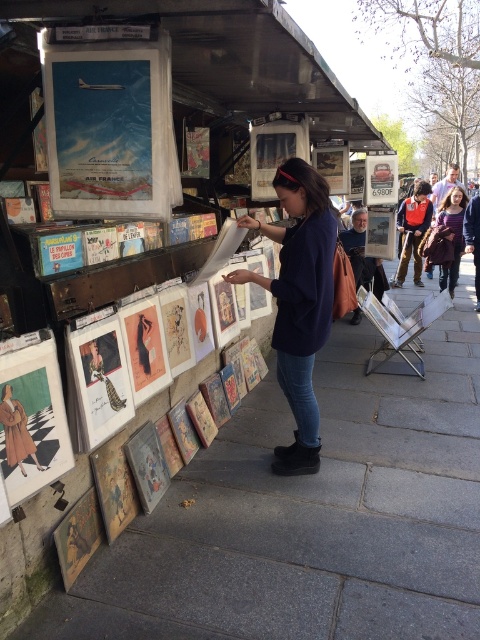
Does jeans at center have a smaller size compared to blue denim jeans at center?

→ Yes.

Who is more forward, (285, 365) or (442, 289)?

Point (285, 365) is in front.

Locate an element on the screen. jeans at center is located at coordinates (300, 396).

What do you see at coordinates (299, 301) in the screenshot? The height and width of the screenshot is (640, 480). I see `dark blue sweater at center` at bounding box center [299, 301].

Between dark blue sweater at center and striped sweater at center, which one is positioned lower?

dark blue sweater at center is lower down.

Where is `dark blue sweater at center`? The height and width of the screenshot is (640, 480). dark blue sweater at center is located at coordinates (299, 301).

Where is `dark blue sweater at center`? The width and height of the screenshot is (480, 640). dark blue sweater at center is located at coordinates (299, 301).

The height and width of the screenshot is (640, 480). Describe the element at coordinates (311, 515) in the screenshot. I see `smooth concrete pavement at center` at that location.

Locate an element on the screen. This screenshot has height=640, width=480. smooth concrete pavement at center is located at coordinates (311, 515).